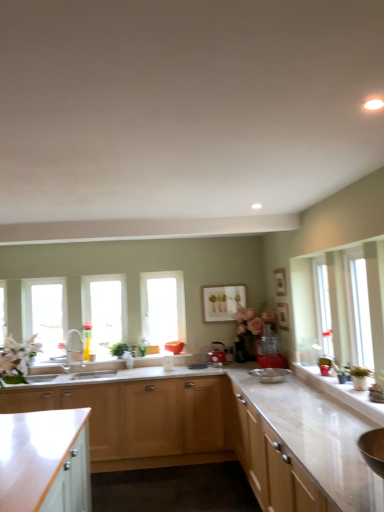
Find the location of a particular element. This screenshot has height=512, width=384. free point above light wood cabinet at right, placed as the third cabinetry when sorted from left to right (from a real-world perspective) is located at coordinates (296, 414).